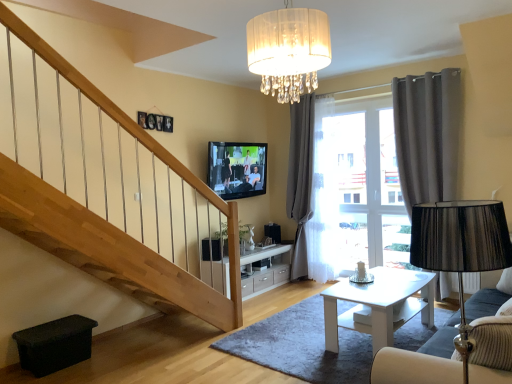
The image size is (512, 384). What are the coordinates of `vacant region to the left of white glossy coffee table at center` in the screenshot? It's located at (292, 339).